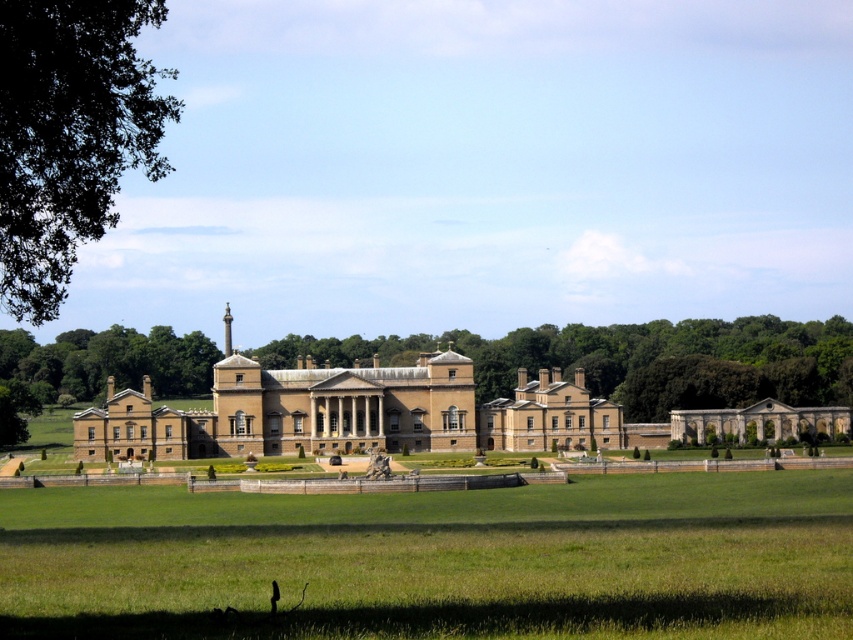
You are standing in front of the classical building and want to walk from the green leafy tree at upper left to the green grass at center. Which direction should you head?

The green grass at center is to the right of the green leafy tree at upper left, so you should head to the right.

You are standing in front of the classical building and want to walk from point A to point B. If point A is at point (556, 570) and point B is at point (56, 164), which direction should you move to get closer to point B?

To move from point A at (556, 570) to point B at (56, 164), you should move towards the lower left direction since point B is located lower and to the left compared to point A.